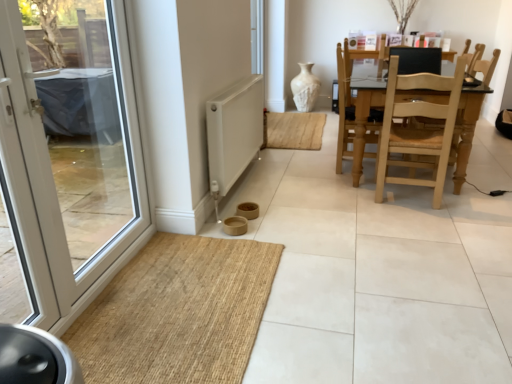
Find the location of a particular element. The image size is (512, 384). vacant region above brown woven mat at lower left (from a real-world perspective) is located at coordinates (184, 299).